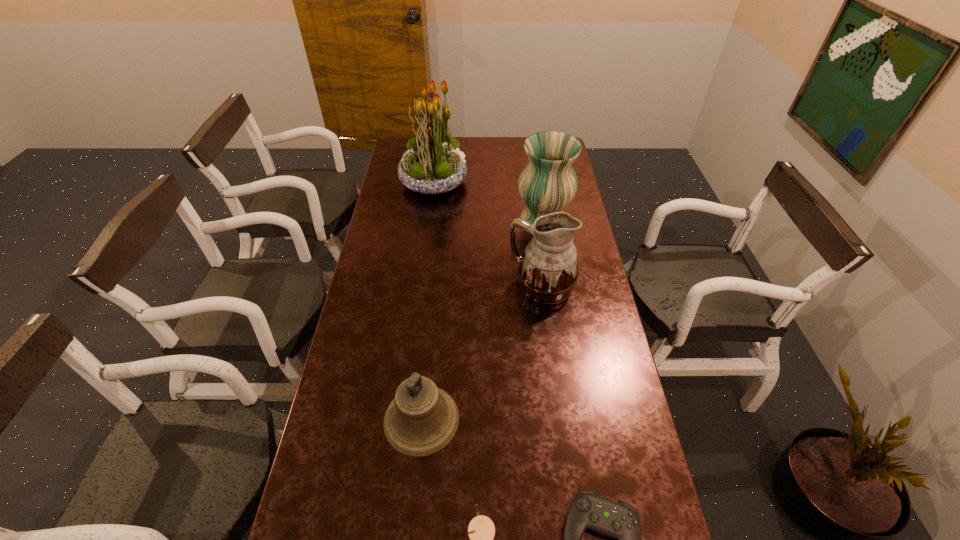
You are a GUI agent. You are given a task and a screenshot of the screen. Output one action in this format:
    pyautogui.click(x=<x>, y=<y>)
    Task: Click on the vacant region between the fourth farthest object and the third farthest object
    The width and height of the screenshot is (960, 540).
    Given the screenshot: What is the action you would take?
    pyautogui.click(x=482, y=353)

Locate an element on the screen. This screenshot has height=540, width=960. free space between the vase and the flower arrangement is located at coordinates (489, 200).

Locate which object is the second closest to the control. Please provide its 2D coordinates. Your answer should be formatted as a tuple, i.e. [(x, y)], where the tuple contains the x and y coordinates of a point satisfying the conditions above.

[(422, 419)]

Image resolution: width=960 pixels, height=540 pixels. Find the location of `the fifth closest object to the pitcher`. the fifth closest object to the pitcher is located at coordinates (481, 530).

Image resolution: width=960 pixels, height=540 pixels. What are the coordinates of `free point that satisfies the following two spatial constraints: 1. on the front-facing side of the vase; 2. on the left side of the tallest object` in the screenshot? It's located at (428, 220).

I want to click on vacant region that satisfies the following two spatial constraints: 1. on the back side of the vase; 2. on the front-facing side of the tallest object, so click(x=537, y=181).

You are a GUI agent. You are given a task and a screenshot of the screen. Output one action in this format:
    pyautogui.click(x=<x>, y=<y>)
    Task: Click on the vacant area in the image that satisfies the following two spatial constraints: 1. on the front-facing side of the tallest object; 2. on the left side of the vase
    The width and height of the screenshot is (960, 540).
    Given the screenshot: What is the action you would take?
    pyautogui.click(x=428, y=220)